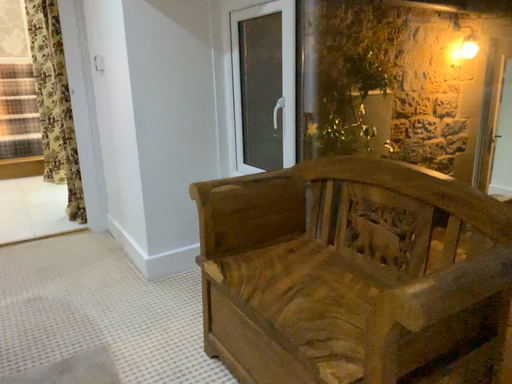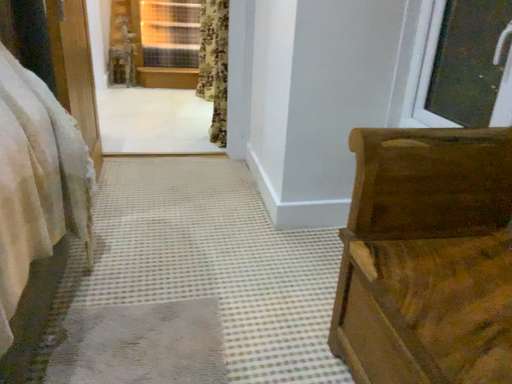
Question: Which way did the camera rotate in the video?

Choices:
 (A) rotated left
 (B) rotated right

Answer: (A)